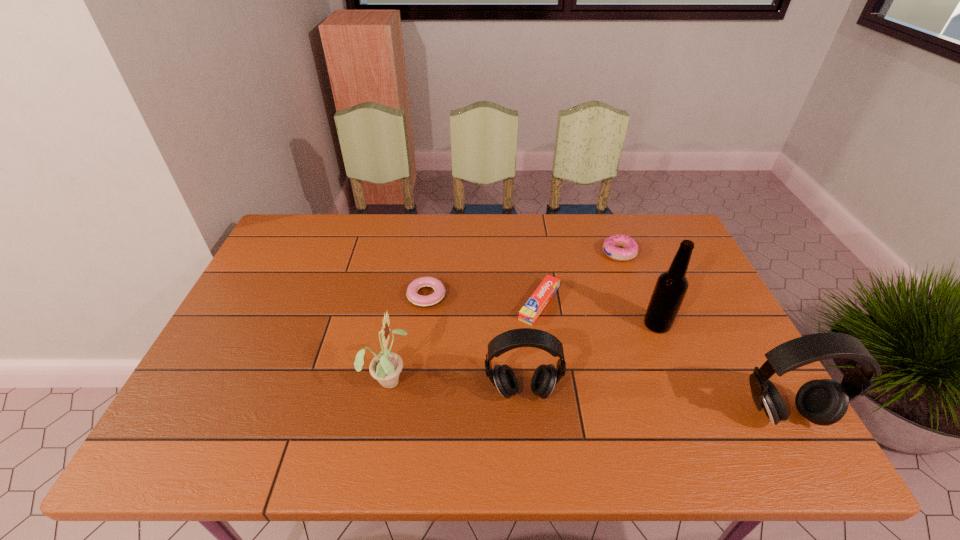
Please point out where to position a new earphone on the left to maintain spacing. Please provide its 2D coordinates. Your answer should be formatted as a tuple, i.e. [(x, y)], where the tuple contains the x and y coordinates of a point satisfying the conditions above.

[(283, 370)]